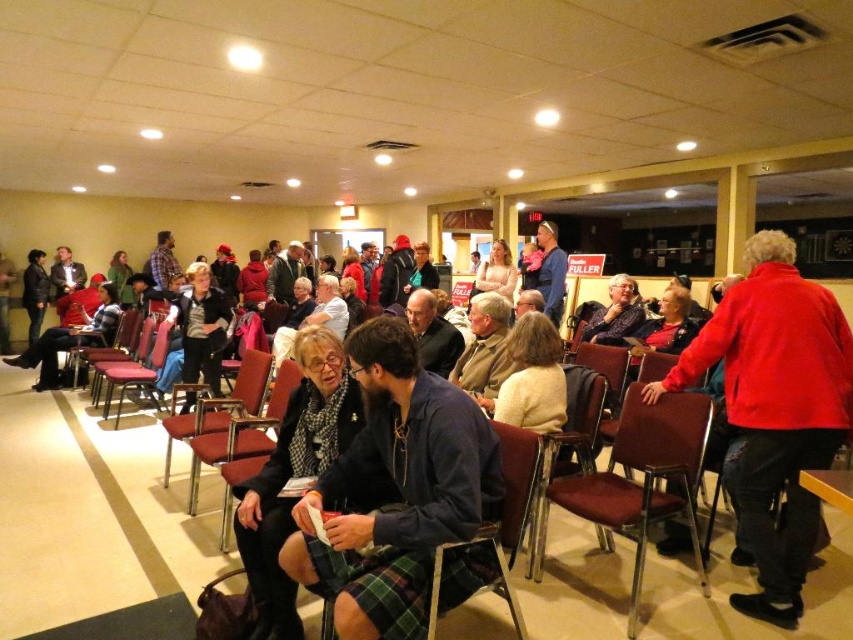
You are an event planner arranging seating for an upcoming workshop. You notice the plaid skirt at center and the metallic silver chair at center in the current setup. Which object is positioned lower in the image?

The plaid skirt at center is located below the metallic silver chair at center, so the plaid skirt at center is positioned lower in the image.

You are standing at point [115,333] in the large hall. You need to walk to the exit sign located at the back of the room. If you walk straight ahead from your current position, will you reach the exit sign before reaching point [412,387]?

Point [412,387] is in front of point [115,333], so walking straight ahead from point [115,333] will reach point [412,387] before the exit sign at the back of the room. Therefore, you will reach point [412,387] before the exit sign.